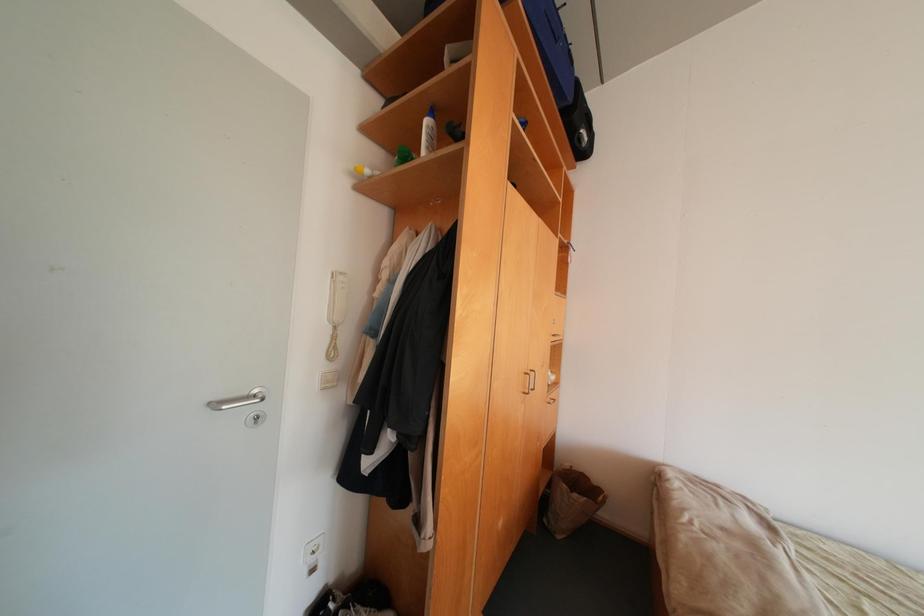
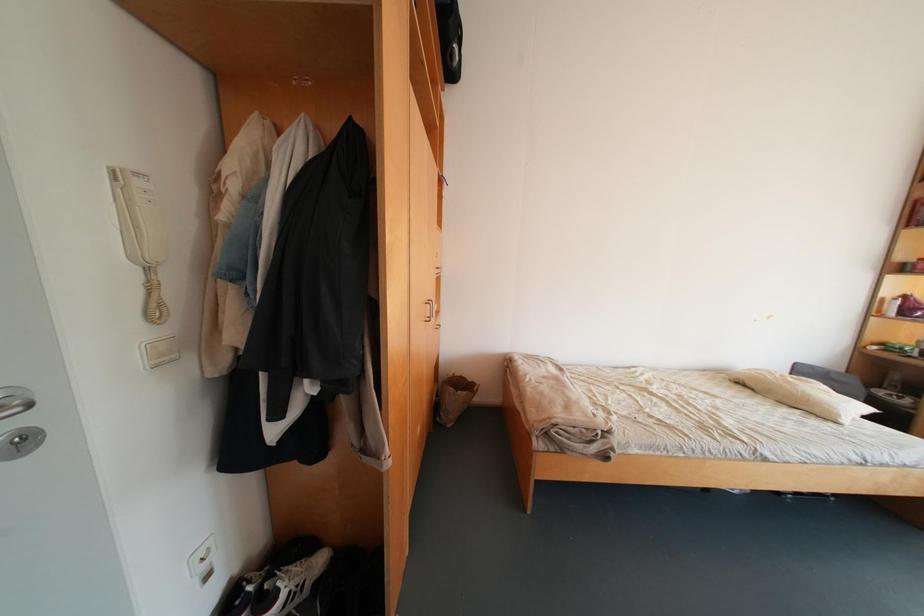
Question: The images are taken continuously from a first-person perspective. In which direction is your viewpoint rotating?

Choices:
 (A) Left
 (B) Right
 (C) Up
 (D) Down

Answer: (B)